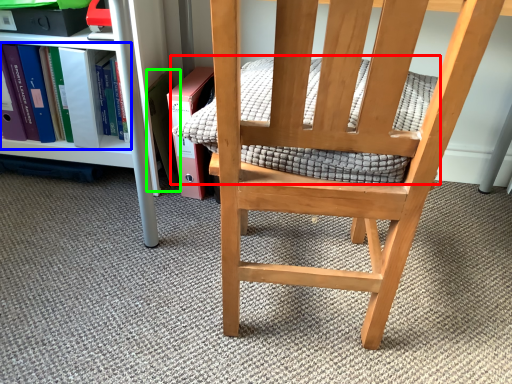
Question: Considering the real-world distances, which object is closest to quilt (highlighted by a red box)? book (highlighted by a blue box) or paperback book (highlighted by a green box).

Choices:
 (A) book
 (B) paperback book

Answer: (B)